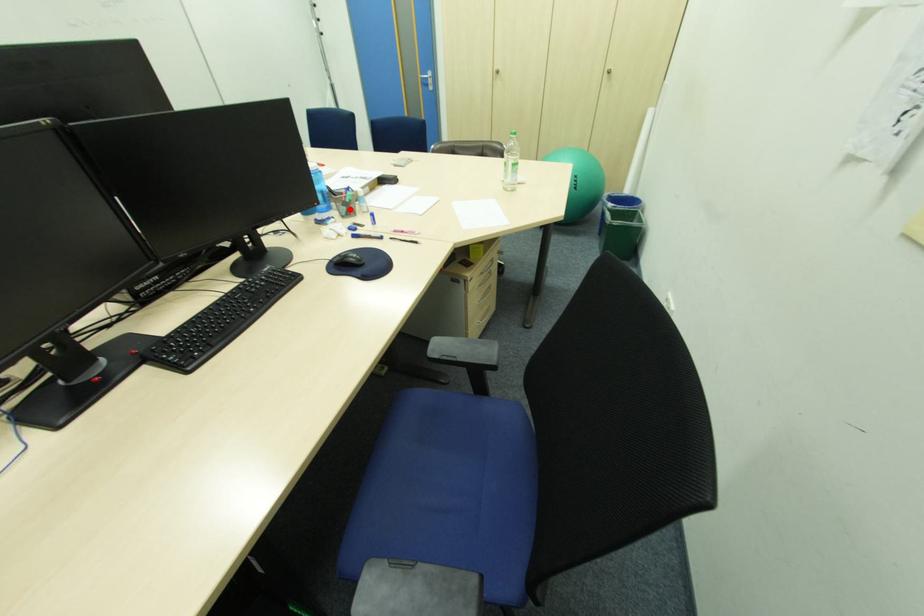
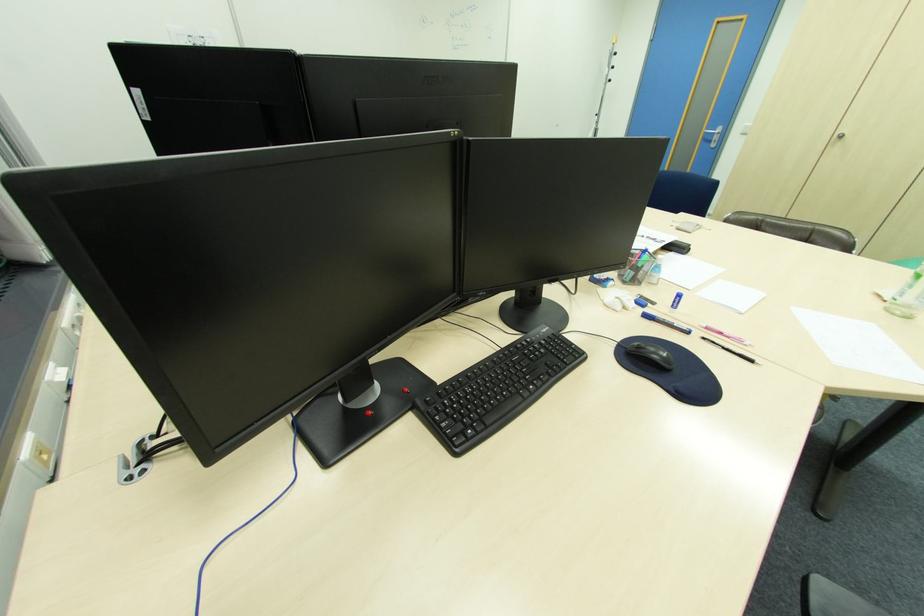
In the second image, find the point that corresponds to the highlighted location in the first image.

(637, 274)